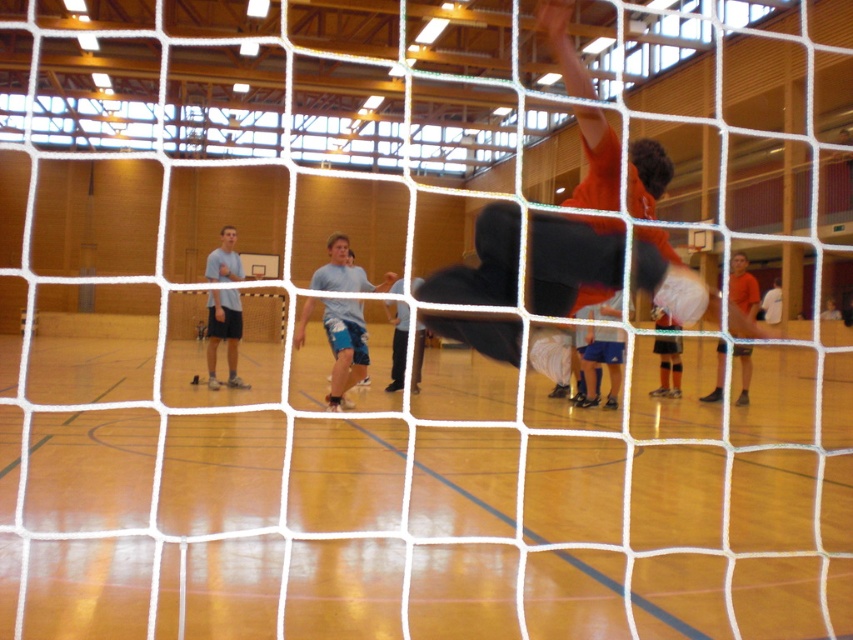
Question: Which object is the farthest from the orange jersey shorts at center?

Choices:
 (A) orange jersey at right
 (B) light blue cotton shorts at center

Answer: (B)

Question: Which object is closer to the camera taking this photo?

Choices:
 (A) light blue t-shirt at left
 (B) white knee-high socks at center
 (C) orange jersey at upper right

Answer: (A)

Question: Does light blue t-shirt at left appear on the right side of orange jersey shorts at center?

Choices:
 (A) no
 (B) yes

Answer: (A)

Question: Is light blue shorts at center smaller than white knee-high socks at center?

Choices:
 (A) no
 (B) yes

Answer: (A)

Question: Considering the real-world distances, which object is closest to the white knee-high socks at center?

Choices:
 (A) orange jersey shorts at center
 (B) orange jersey at upper right

Answer: (A)

Question: Does orange jersey at upper right lie behind orange jersey shorts at center?

Choices:
 (A) yes
 (B) no

Answer: (B)